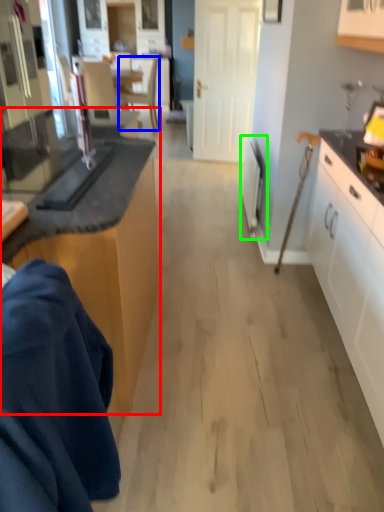
Question: Based on their relative distances, which object is nearer to cabinetry (highlighted by a red box)? Choose from chair (highlighted by a blue box) and appliance (highlighted by a green box).

Choices:
 (A) chair
 (B) appliance

Answer: (B)